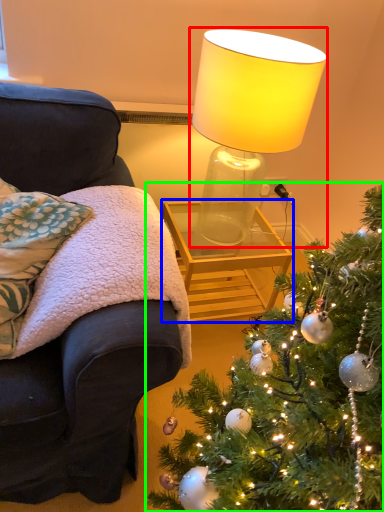
Question: Estimate the real-world distances between objects in this image. Which object is closer to lamp (highlighted by a red box), table (highlighted by a blue box) or christmas tree (highlighted by a green box)?

Choices:
 (A) table
 (B) christmas tree

Answer: (A)